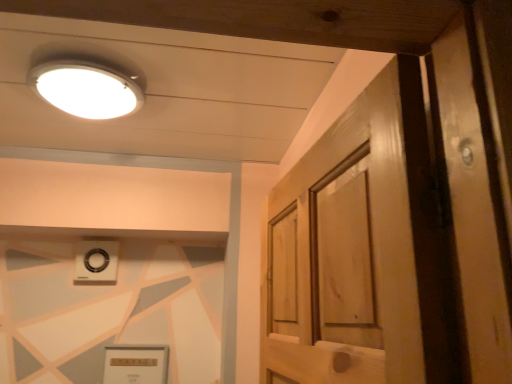
Where is `white glossy light fixture at upper left`? white glossy light fixture at upper left is located at coordinates (86, 88).

What do you see at coordinates (86, 88) in the screenshot? The image size is (512, 384). I see `white glossy light fixture at upper left` at bounding box center [86, 88].

Where is `white plastic knob at upper center`? This screenshot has height=384, width=512. white plastic knob at upper center is located at coordinates (96, 261).

Is matte gold picture frame at lower center not near white plastic knob at upper center?

No, matte gold picture frame at lower center is not far from white plastic knob at upper center.

Does matte gold picture frame at lower center lie behind white plastic knob at upper center?

That is False.

Is matte gold picture frame at lower center surrounding white plastic knob at upper center?

Actually, white plastic knob at upper center is outside matte gold picture frame at lower center.

You are a GUI agent. You are given a task and a screenshot of the screen. Output one action in this format:
    pyautogui.click(x=<x>, y=<y>)
    Task: Click on the knob behind the matte gold picture frame at lower center
    This screenshot has height=384, width=512.
    Given the screenshot: What is the action you would take?
    pyautogui.click(x=96, y=261)

Can white glossy light fixture at upper left be found inside matte gold picture frame at lower center?

Definitely not — white glossy light fixture at upper left is not inside matte gold picture frame at lower center.

I want to click on lighting positioned vertically above the matte gold picture frame at lower center (from a real-world perspective), so click(x=86, y=88).

Is the position of matte gold picture frame at lower center less distant than that of white glossy light fixture at upper left?

That is False.

Looking at this image, in terms of size, does matte gold picture frame at lower center appear bigger or smaller than white glossy light fixture at upper left?

matte gold picture frame at lower center is smaller than white glossy light fixture at upper left.

Who is more distant, white plastic knob at upper center or white glossy light fixture at upper left?

white plastic knob at upper center.

How many degrees apart are the facing directions of white plastic knob at upper center and white glossy light fixture at upper left?

There is a 0.235-degree angle between the facing directions of white plastic knob at upper center and white glossy light fixture at upper left.

From the image's perspective, is white plastic knob at upper center below white glossy light fixture at upper left?

Indeed, from the image's perspective, white plastic knob at upper center is shown beneath white glossy light fixture at upper left.

Is white glossy light fixture at upper left at the back of white plastic knob at upper center?

No, white glossy light fixture at upper left is not at the back of white plastic knob at upper center.

Which point is more distant from viewer, [103,106] or [104,378]?

The point [104,378] is more distant.

Considering the sizes of objects white glossy light fixture at upper left and matte gold picture frame at lower center in the image provided, who is shorter, white glossy light fixture at upper left or matte gold picture frame at lower center?

white glossy light fixture at upper left is shorter.

From the image's perspective, which is below, white glossy light fixture at upper left or matte gold picture frame at lower center?

From the image's view, matte gold picture frame at lower center is below.

Is white plastic knob at upper center facing away from matte gold picture frame at lower center?

No, matte gold picture frame at lower center is not at the back of white plastic knob at upper center.

Which of these two, white plastic knob at upper center or matte gold picture frame at lower center, stands taller?

Standing taller between the two is matte gold picture frame at lower center.

Does white plastic knob at upper center have a smaller size compared to matte gold picture frame at lower center?

Correct, white plastic knob at upper center occupies less space than matte gold picture frame at lower center.

From a real-world perspective, is white plastic knob at upper center positioned under matte gold picture frame at lower center based on gravity?

No.

Does white glossy light fixture at upper left turn towards white plastic knob at upper center?

No, white glossy light fixture at upper left is not aimed at white plastic knob at upper center.

From the image's perspective, is white glossy light fixture at upper left under white plastic knob at upper center?

No, from the image's perspective, white glossy light fixture at upper left is not below white plastic knob at upper center.

Based on the photo, does white glossy light fixture at upper left touch white plastic knob at upper center?

No.

Find the location of a particular element. picture frame in front of the white plastic knob at upper center is located at coordinates (136, 364).

Locate an element on the screen. The width and height of the screenshot is (512, 384). lighting lying on the right of matte gold picture frame at lower center is located at coordinates (86, 88).

Estimate the real-world distances between objects in this image. Which object is further from white glossy light fixture at upper left, matte gold picture frame at lower center or white plastic knob at upper center?

matte gold picture frame at lower center is positioned further to the anchor white glossy light fixture at upper left.

Based on their spatial positions, is white plastic knob at upper center or matte gold picture frame at lower center closer to white glossy light fixture at upper left?

white plastic knob at upper center is closer to white glossy light fixture at upper left.

Looking at the image, which one is located further to matte gold picture frame at lower center, white glossy light fixture at upper left or white plastic knob at upper center?

white glossy light fixture at upper left lies further to matte gold picture frame at lower center than the other object.

Looking at this image, when comparing their distances from matte gold picture frame at lower center, does white plastic knob at upper center or white glossy light fixture at upper left seem further?

The object further to matte gold picture frame at lower center is white glossy light fixture at upper left.

When comparing their distances from white plastic knob at upper center, does white glossy light fixture at upper left or matte gold picture frame at lower center seem closer?

Among the two, matte gold picture frame at lower center is located nearer to white plastic knob at upper center.

Considering their positions, is matte gold picture frame at lower center positioned further to white plastic knob at upper center than white glossy light fixture at upper left?

white glossy light fixture at upper left is positioned further to the anchor white plastic knob at upper center.

I want to click on knob between white glossy light fixture at upper left and matte gold picture frame at lower center in the vertical direction, so click(96, 261).